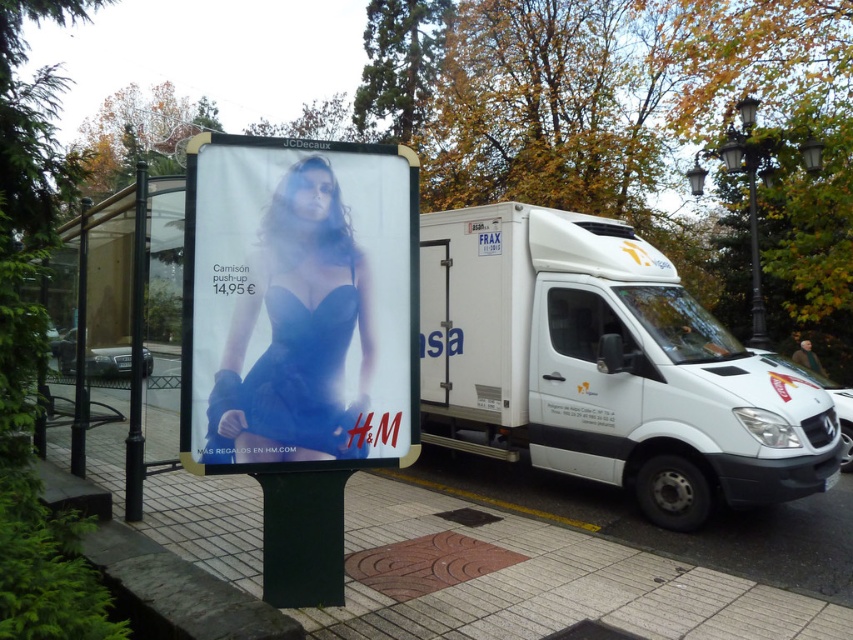
You are a delivery person who needs to park your van on the smooth concrete pavement at lower center. However, there is a black metal pole at left nearby. Can your van fit on the pavement without hitting the pole?

The smooth concrete pavement at lower center is smaller than the black metal pole at left, so the van may not fit without hitting the pole.

You are a pedestrian standing on the sidewalk and want to see the H M advertisement on the billboard. However, the white matte van at center is blocking your view. Can you see the matte blue lingerie at center on the billboard?

The matte blue lingerie at center is behind the white matte van at center, so the van is blocking your view of it.

You are a pedestrian standing on the sidewalk looking at the billboard. You notice a white matte van at center and a matte blue lingerie at center. Which object is positioned lower in the scene?

The white matte van at center is positioned lower than the matte blue lingerie at center in the scene.